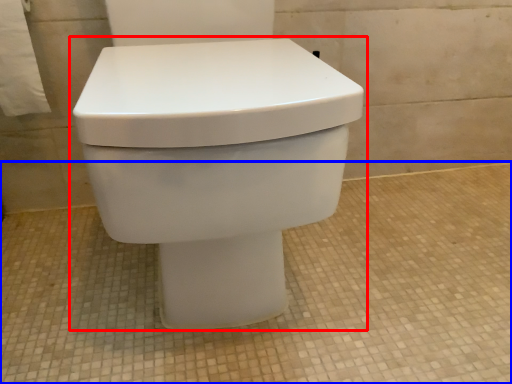
Question: Which object appears farthest to the camera in this image, toilet (highlighted by a red box) or concrete (highlighted by a blue box)?

Choices:
 (A) toilet
 (B) concrete

Answer: (B)